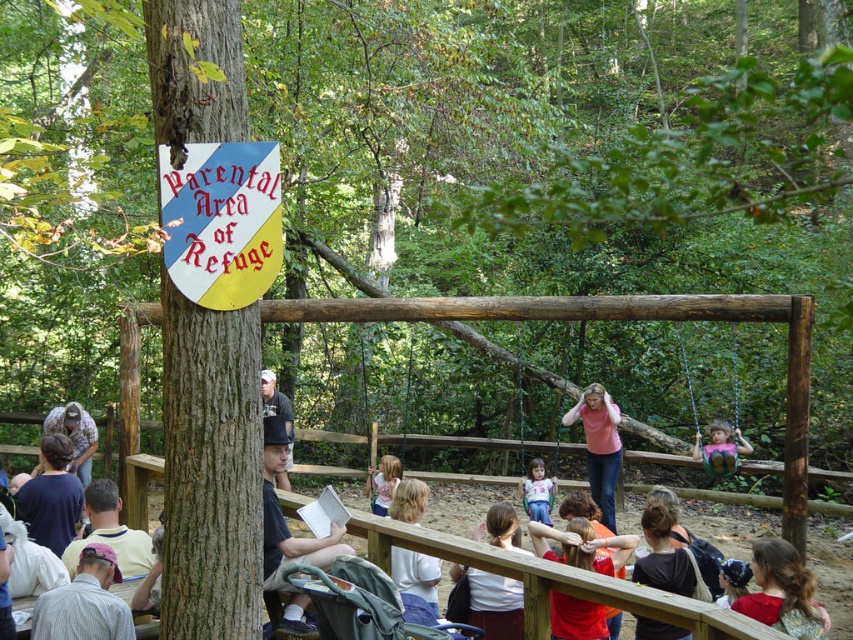
You are a parent looking for the Parental Area of Refuge sign mentioned in the scene. You see a brown rough bark tree at left and a matte pink shirt at center. Which object is closer to the sign?

The brown rough bark tree at left is positioned over the matte pink shirt at center, so the sign is likely closer to the brown rough bark tree at left.